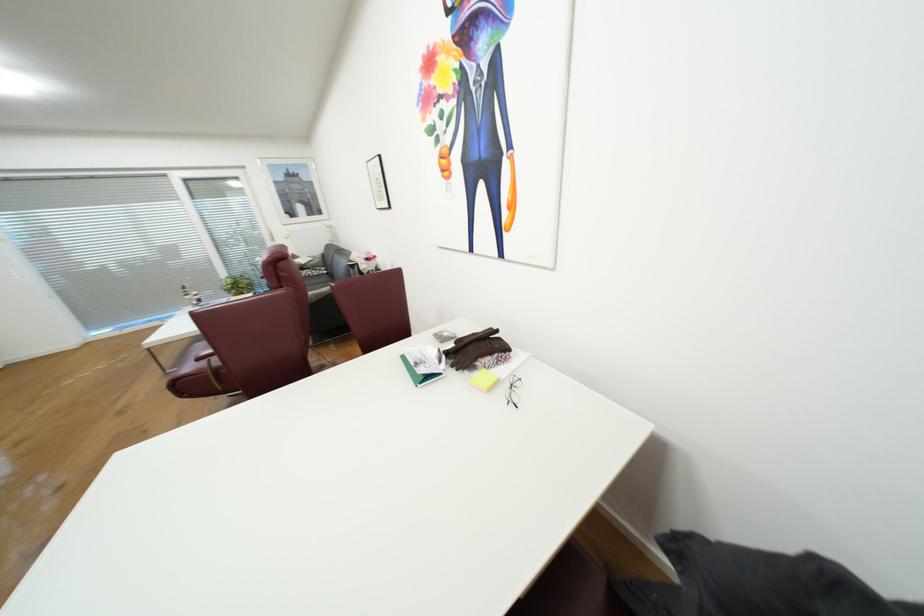
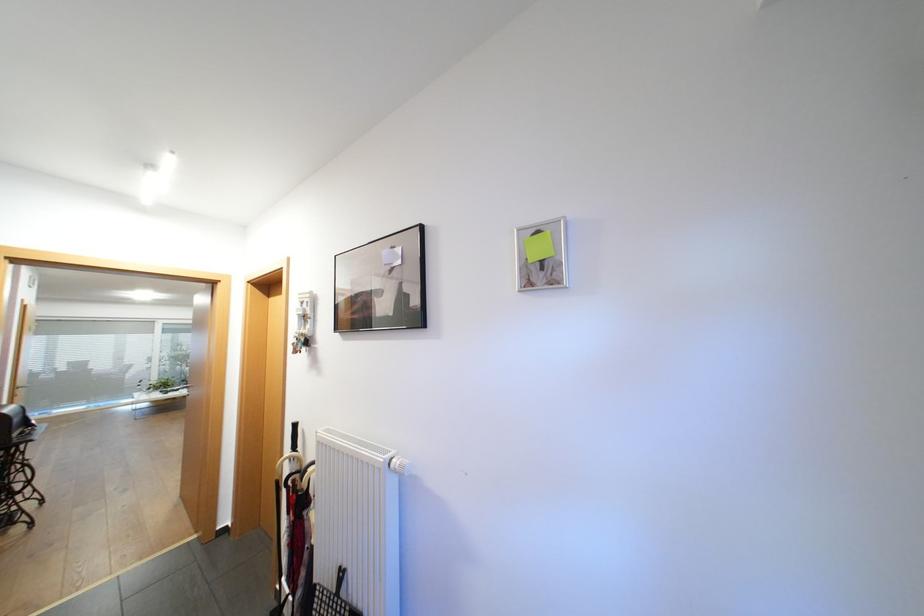
Question: I am providing you with two images of the same scene from different viewpoints. Please identify which objects are invisible in image2.

Choices:
 (A) white radiator knob
 (B) green notebook
 (C) coiled electrical cord
 (D) black umbrella handle

Answer: (B)